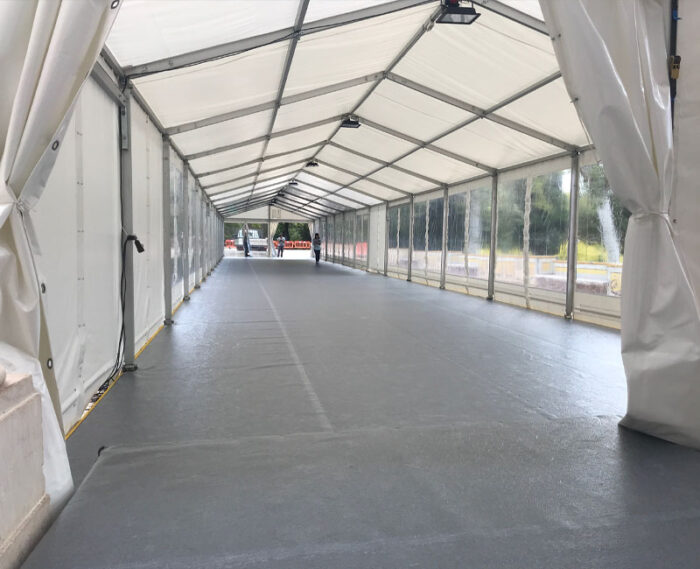
The height and width of the screenshot is (569, 700). Find the location of `elevated flooring/stage`. elevated flooring/stage is located at coordinates (453, 509).